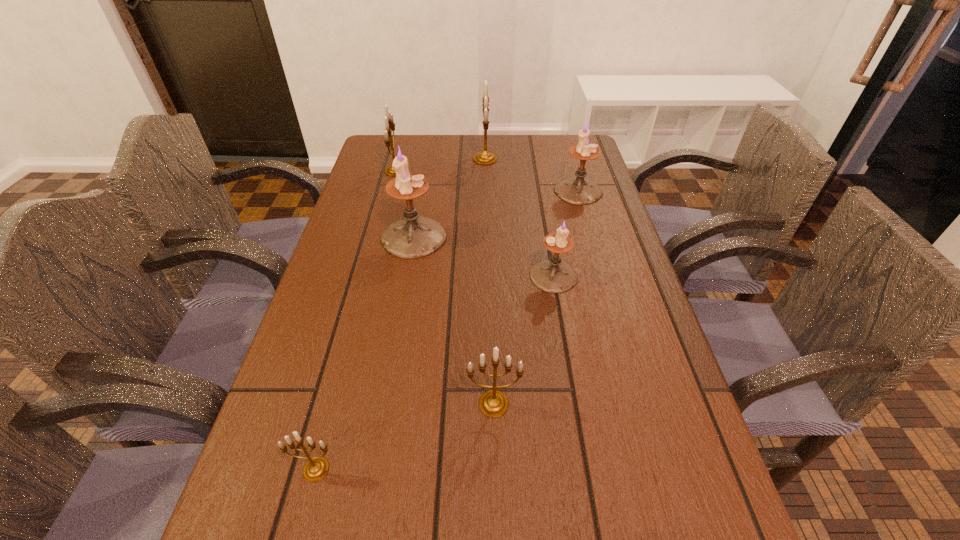
Image resolution: width=960 pixels, height=540 pixels. I want to click on the fourth farthest candelabrum, so click(x=415, y=236).

Identify the location of the leftmost purple candle holder. (415, 236).

The height and width of the screenshot is (540, 960). In order to click on the biggest gold candelabrum in this screenshot , I will do `click(483, 158)`.

You are a GUI agent. You are given a task and a screenshot of the screen. Output one action in this format:
    pyautogui.click(x=<x>, y=<y>)
    Task: Click on the third smallest gold candelabrum
    The width and height of the screenshot is (960, 540).
    Given the screenshot: What is the action you would take?
    pyautogui.click(x=389, y=122)

At what (x,y) coordinates should I click in order to perform the action: click on the farthest purple candle holder. Please return your answer as a coordinate pair (x, y). Looking at the image, I should click on (577, 190).

Image resolution: width=960 pixels, height=540 pixels. I want to click on the smallest purple candle holder, so click(554, 276).

Locate an element on the screen. The width and height of the screenshot is (960, 540). the fifth farthest object is located at coordinates (554, 276).

Where is `the third farthest gold candelabrum`? This screenshot has height=540, width=960. the third farthest gold candelabrum is located at coordinates (493, 403).

At what (x,y) coordinates should I click in order to perform the action: click on the second nearest candelabrum. Please return your answer as a coordinate pair (x, y). Looking at the image, I should click on (493, 403).

Locate an element on the screen. the nearest gold candelabrum is located at coordinates (316, 468).